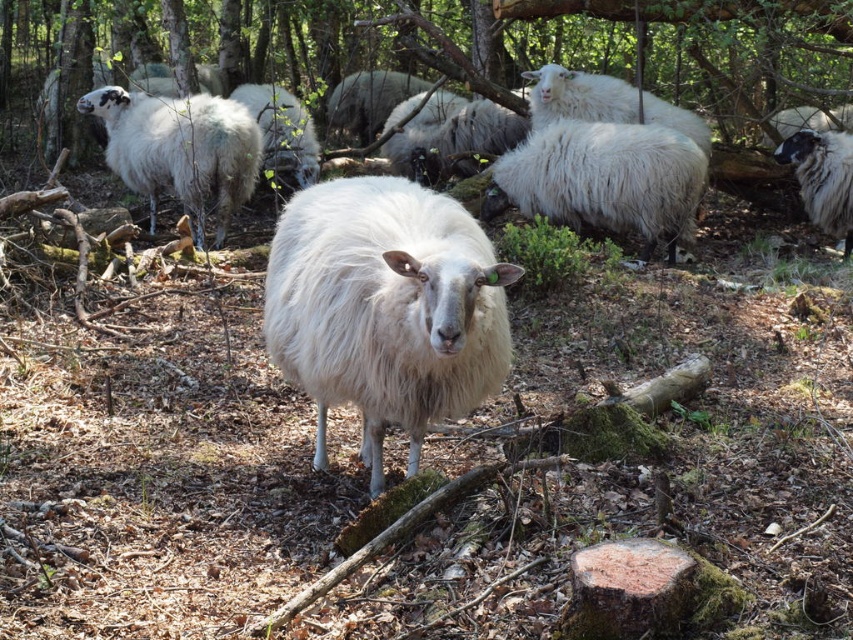
Question: Is green mossy log at upper center positioned behind white fluffy sheep at upper left?

Choices:
 (A) no
 (B) yes

Answer: (B)

Question: Which object is farther from the camera taking this photo?

Choices:
 (A) white fluffy sheep at upper left
 (B) white fluffy sheep at upper right

Answer: (B)

Question: Considering the real-world distances, which object is closest to the white fluffy sheep at upper right?

Choices:
 (A) white fluffy sheep at center
 (B) white fluffy sheep at upper left

Answer: (B)

Question: Is white fluffy sheep at center to the right of white woolen sheep at right from the viewer's perspective?

Choices:
 (A) no
 (B) yes

Answer: (A)

Question: Which object is positioned closest to the white fluffy sheep at upper left?

Choices:
 (A) white fluffy sheep at center
 (B) white woolen sheep at right
 (C) green mossy log at upper center

Answer: (C)

Question: Considering the relative positions of white fluffy sheep at upper left and white fluffy sheep at upper right in the image provided, where is white fluffy sheep at upper left located with respect to white fluffy sheep at upper right?

Choices:
 (A) left
 (B) right

Answer: (A)